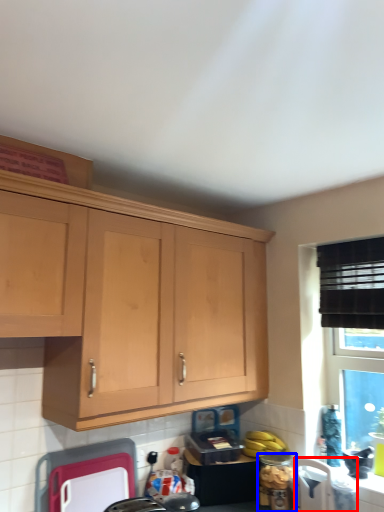
Question: Which object appears closest to the camera in this image, appliance (highlighted by a red box) or appliance (highlighted by a blue box)?

Choices:
 (A) appliance
 (B) appliance

Answer: (A)